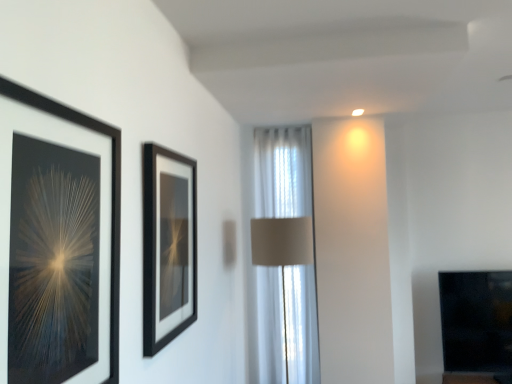
Question: From the image's perspective, would you say black matte picture frame at left, placed as the first picture frame when sorted from front to back, is shown under white sheer curtain at center?

Choices:
 (A) no
 (B) yes

Answer: (A)

Question: Is black matte picture frame at left, marked as the second picture frame in a back-to-front arrangement, with white sheer curtain at center?

Choices:
 (A) no
 (B) yes

Answer: (A)

Question: Is black matte picture frame at left, placed as the first picture frame when sorted from front to back, bigger than white sheer curtain at center?

Choices:
 (A) no
 (B) yes

Answer: (A)

Question: From the image's perspective, is black matte picture frame at left, marked as the second picture frame in a back-to-front arrangement, above white sheer curtain at center?

Choices:
 (A) no
 (B) yes

Answer: (B)

Question: Considering the relative positions of black matte picture frame at left, placed as the first picture frame when sorted from front to back, and white sheer curtain at center in the image provided, is black matte picture frame at left, placed as the first picture frame when sorted from front to back, to the left of white sheer curtain at center from the viewer's perspective?

Choices:
 (A) yes
 (B) no

Answer: (A)

Question: In terms of width, does white sheer curtain at center look wider or thinner when compared to black matte picture frame at center, the 2th picture frame in the front-to-back sequence?

Choices:
 (A) wide
 (B) thin

Answer: (A)

Question: Is point (300, 157) positioned closer to the camera than point (156, 220)?

Choices:
 (A) farther
 (B) closer

Answer: (A)

Question: Considering the positions of white sheer curtain at center and black matte picture frame at center, which is the 2th picture frame from left to right, in the image, is white sheer curtain at center bigger or smaller than black matte picture frame at center, which is the 2th picture frame from left to right,?

Choices:
 (A) big
 (B) small

Answer: (A)

Question: Is white sheer curtain at center spatially inside black matte picture frame at center, which is the 1th picture frame from right to left, or outside of it?

Choices:
 (A) outside
 (B) inside

Answer: (A)

Question: Relative to black matte picture frame at left, placed as the first picture frame when sorted from front to back, is white sheer curtain at center in front or behind?

Choices:
 (A) behind
 (B) front

Answer: (A)

Question: Is white sheer curtain at center to the left or to the right of black matte picture frame at left, the second picture frame from the right, in the image?

Choices:
 (A) right
 (B) left

Answer: (A)

Question: Is point (253, 187) closer or farther from the camera than point (100, 324)?

Choices:
 (A) farther
 (B) closer

Answer: (A)

Question: In terms of width, does white sheer curtain at center look wider or thinner when compared to black matte picture frame at left, placed as the first picture frame when sorted from front to back?

Choices:
 (A) thin
 (B) wide

Answer: (B)

Question: Looking at their shapes, would you say black glass fireplace at lower right is wider or thinner than black matte picture frame at left, the second picture frame from the right?

Choices:
 (A) wide
 (B) thin

Answer: (A)

Question: Considering their positions, is black glass fireplace at lower right located in front of or behind black matte picture frame at left, marked as the second picture frame in a back-to-front arrangement?

Choices:
 (A) behind
 (B) front

Answer: (A)